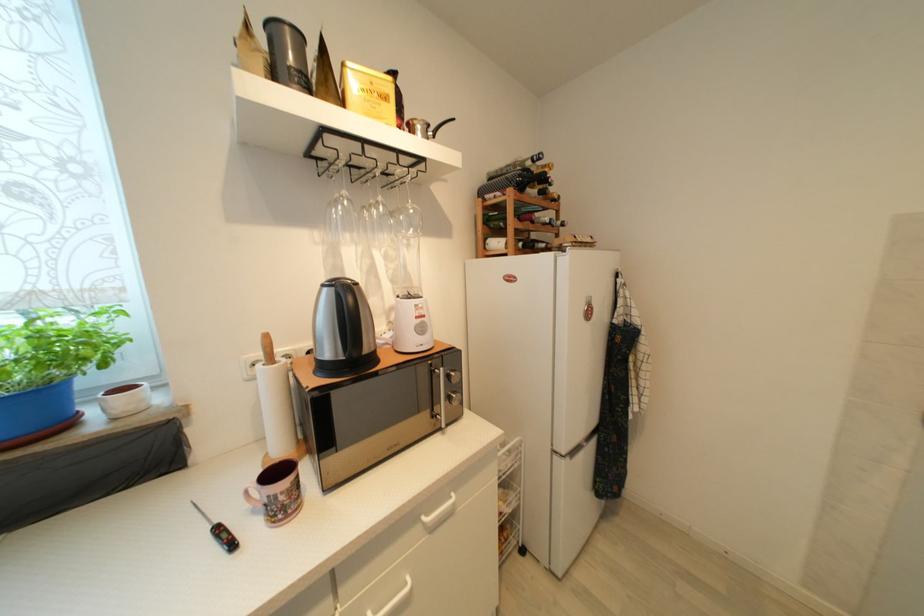
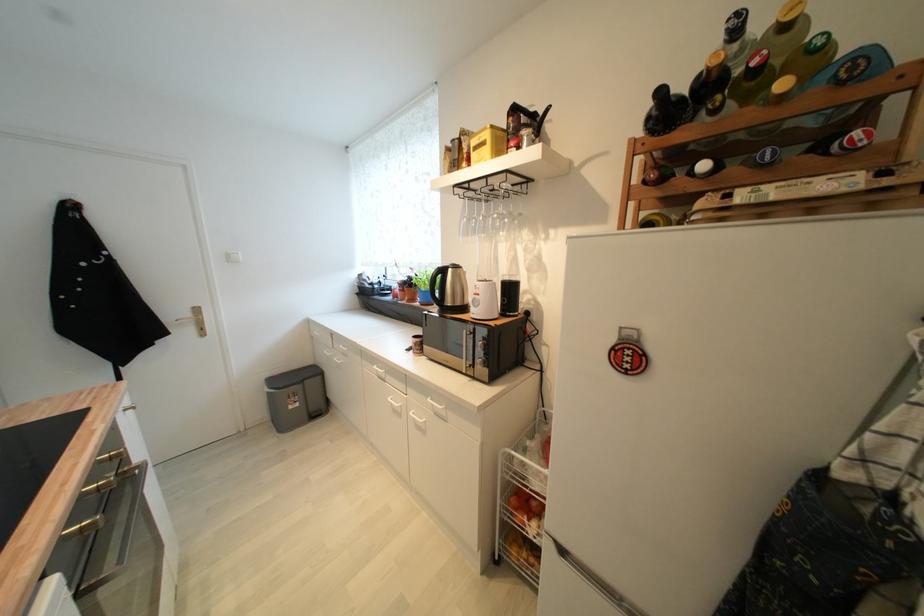
Where in the second image is the point corresponding to point 448,429 from the first image?

(469, 374)